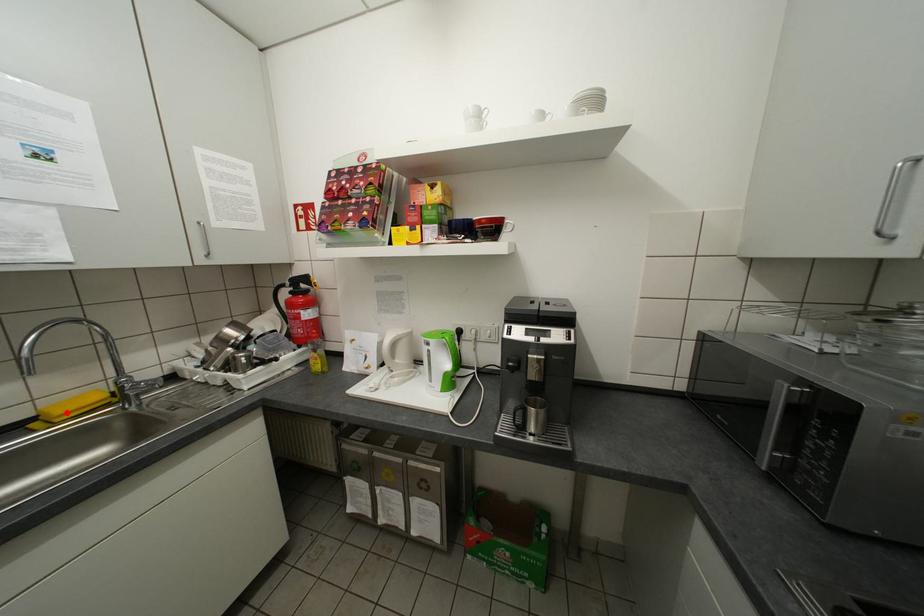
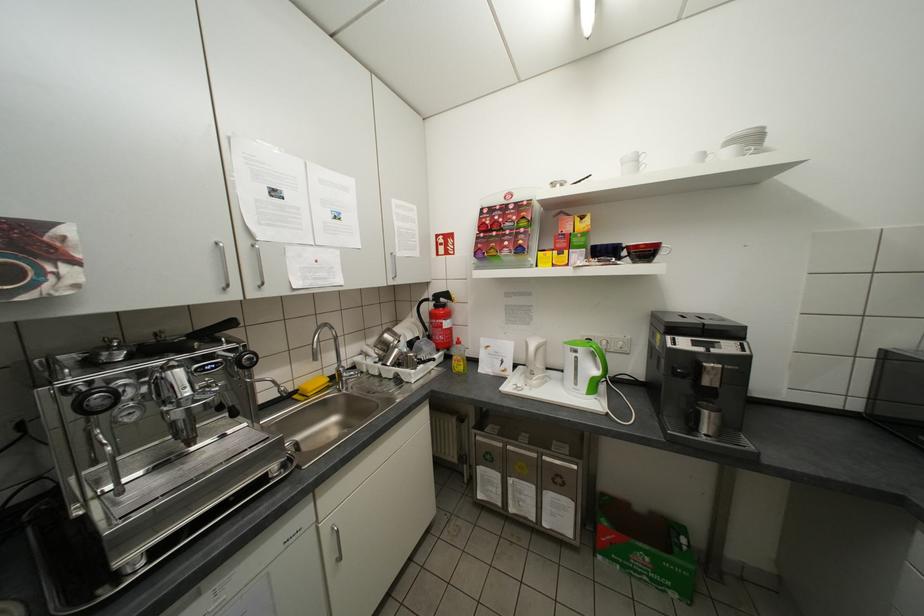
Find the pixel in the second image that matches the highlighted location in the first image.

(319, 389)